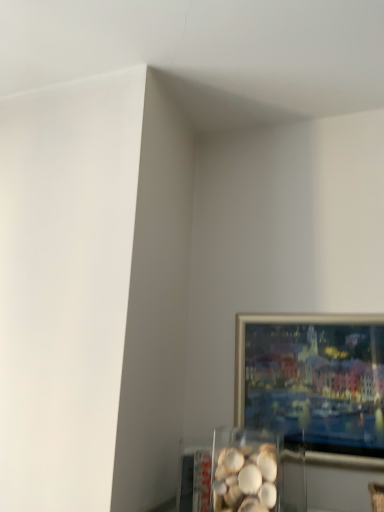
In order to face white matte seashells at lower center, should I rotate leftwards or rightwards?

Rotate your view right by about 6.388°.

The height and width of the screenshot is (512, 384). I want to click on white matte seashells at lower center, so pos(246,479).

What do you see at coordinates (246, 479) in the screenshot? This screenshot has width=384, height=512. I see `white matte seashells at lower center` at bounding box center [246, 479].

Image resolution: width=384 pixels, height=512 pixels. I want to click on white matte seashells at lower center, so click(x=246, y=479).